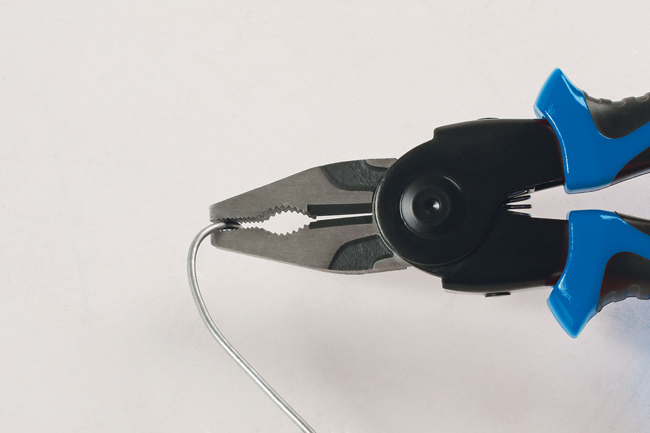
Find the location of a particular element. This screenshot has height=433, width=650. handles is located at coordinates (592, 160), (585, 246).